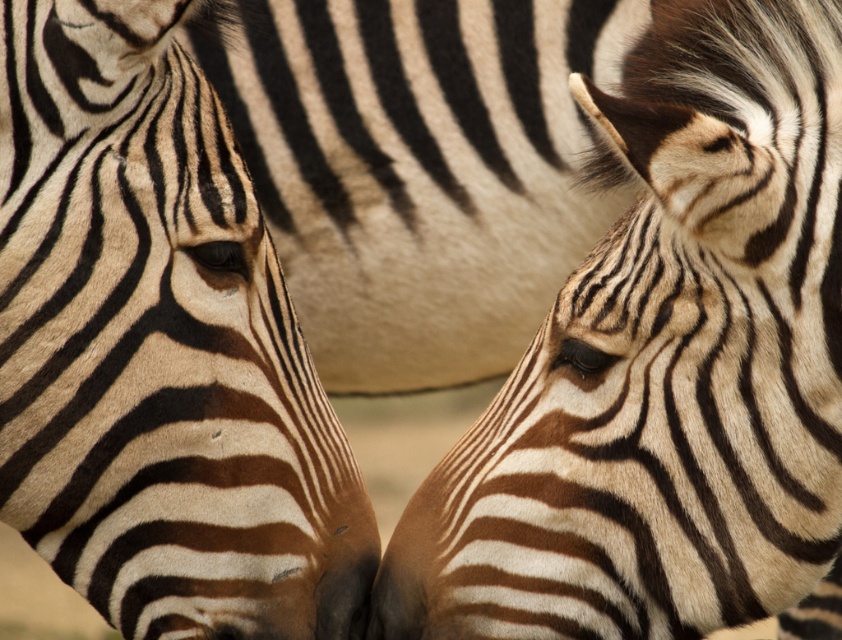
Is black and white striped zebra head at right bigger than black and white striped zebra at center?

Yes.

Does black and white striped zebra head at right come in front of black and white striped zebra at center?

Yes.

Is point (697, 586) less distant than point (84, 420)?

Yes, it is in front of point (84, 420).

Locate an element on the screen. This screenshot has height=640, width=842. black and white striped zebra head at right is located at coordinates (664, 368).

Does point (228, 522) come farther from viewer compared to point (324, 596)?

No, (228, 522) is in front of (324, 596).

Identify the location of black and white striped zebra at center. (152, 339).

You are a GUI agent. You are given a task and a screenshot of the screen. Output one action in this format:
    pyautogui.click(x=<x>, y=<y>)
    Task: Click on the black and white striped zebra at center
    The image size is (842, 640).
    Given the screenshot: What is the action you would take?
    pyautogui.click(x=152, y=339)

Which is above, black and white striped zebra head at right or black matte nose at center?

black and white striped zebra head at right is higher up.

Which is below, black and white striped zebra head at right or black matte nose at center?

black matte nose at center is below.

Which is in front, point (649, 582) or point (356, 564)?

Positioned in front is point (649, 582).

Locate an element on the screen. black and white striped zebra head at right is located at coordinates pos(664,368).